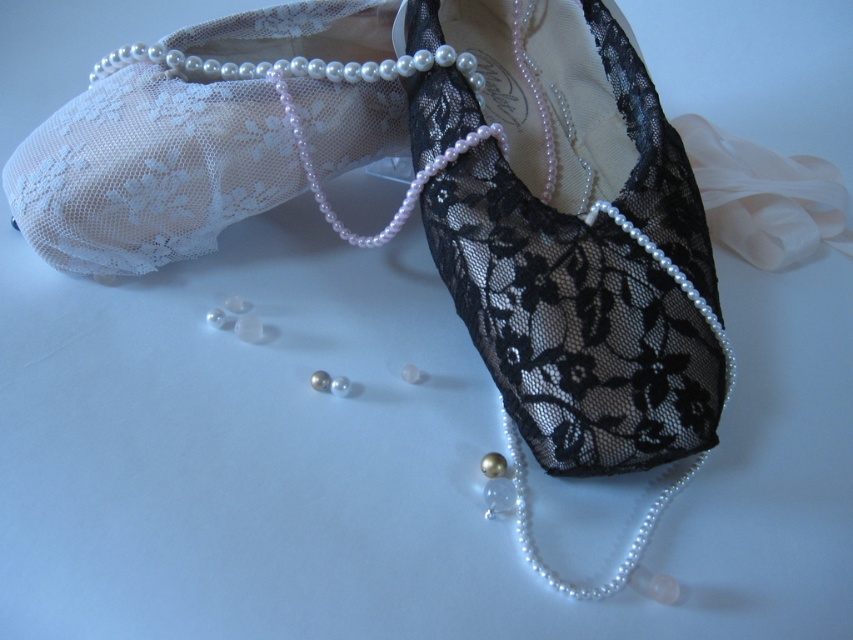
Can you confirm if black lace ballet slipper at upper center is positioned below pearl at center?

Incorrect, black lace ballet slipper at upper center is not positioned below pearl at center.

From the picture: Between black lace ballet slipper at upper center and pearl at center, which one is positioned higher?

black lace ballet slipper at upper center is above.

Locate an element on the screen. The image size is (853, 640). black lace ballet slipper at upper center is located at coordinates (222, 132).

Where is `black lace ballet slipper at upper center`? Image resolution: width=853 pixels, height=640 pixels. black lace ballet slipper at upper center is located at coordinates (222, 132).

Who is higher up, pearl/glass at lower center or pearl/golden at center?

Positioned higher is pearl/golden at center.

Which is more to the right, pearl/glass at lower center or pearl/golden at center?

pearl/glass at lower center

Which is behind, point (480, 460) or point (328, 387)?

The point (328, 387) is more distant.

Where is `pearl/glass at lower center`? Image resolution: width=853 pixels, height=640 pixels. pearl/glass at lower center is located at coordinates [492, 465].

Can you confirm if black lace ballet slipper at upper center is thinner than pearl/golden at center?

No, black lace ballet slipper at upper center is not thinner than pearl/golden at center.

Who is taller, black lace ballet slipper at upper center or pearl/golden at center?

Standing taller between the two is black lace ballet slipper at upper center.

Between point (242, 131) and point (321, 392), which one is positioned behind?

The point (242, 131) is more distant.

Identify the location of black lace ballet slipper at upper center. Image resolution: width=853 pixels, height=640 pixels. (222, 132).